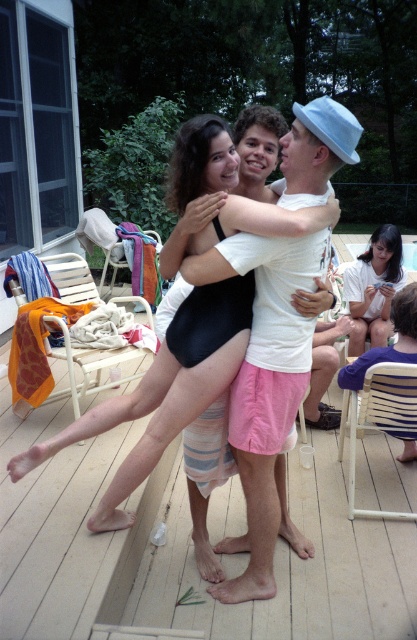
Question: Which point is farther to the camera?

Choices:
 (A) (376, 268)
 (B) (235, 200)

Answer: (A)

Question: Can you confirm if black matte swimsuit at center is positioned to the right of matte white shirt at upper right?

Choices:
 (A) no
 (B) yes

Answer: (A)

Question: Is black matte swimsuit at center positioned at the back of matte white shirt at upper right?

Choices:
 (A) yes
 (B) no

Answer: (B)

Question: Can you confirm if black matte swimsuit at center is positioned to the right of matte white shirt at upper right?

Choices:
 (A) no
 (B) yes

Answer: (A)